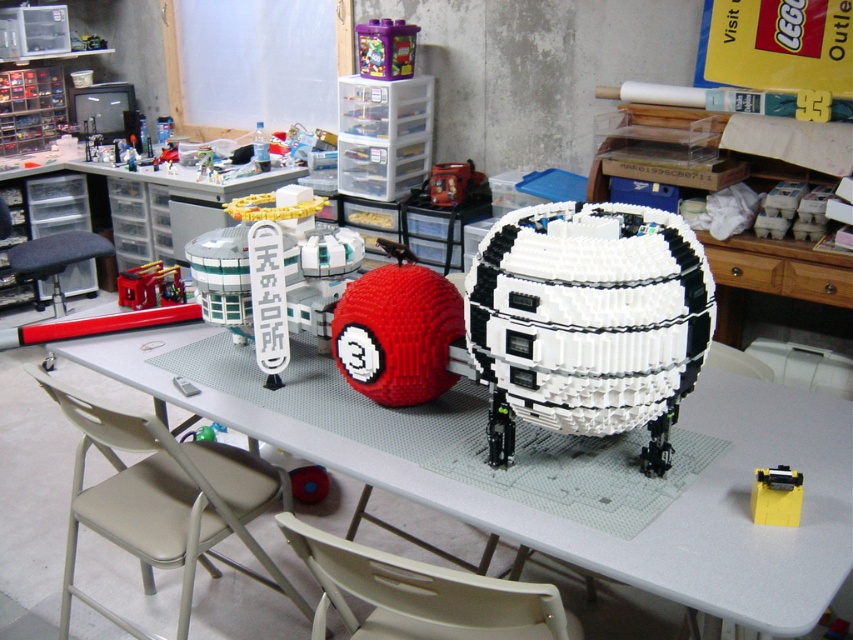
You are a visitor sitting at the beige plastic chair at lower center and want to see the yellow plastic car at lower right. Can you see it without moving your head?

The beige plastic chair at lower center is taller than the yellow plastic car at lower right, so yes, you can see it without moving your head because the chair elevates your viewpoint above the car.

You are a child who wants to reach the metallic red backpack at center to put your toys inside. You see the yellow plastic car at lower right nearby. Which object is taller so you can climb on it to reach the backpack?

The metallic red backpack at center is taller than the yellow plastic car at lower right, so you can climb on the metallic red backpack at center to reach the backpack. However, since the backpack is the one you want to reach into, this might not be practical. Alternatively, you could use another stable object, but based on the given items, the metallic red backpack at center is the taller one.